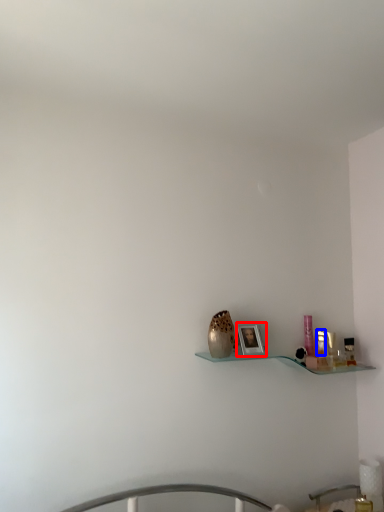
Question: Which object is further to the camera taking this photo, picture frame (highlighted by a red box) or toiletry (highlighted by a blue box)?

Choices:
 (A) picture frame
 (B) toiletry

Answer: (B)